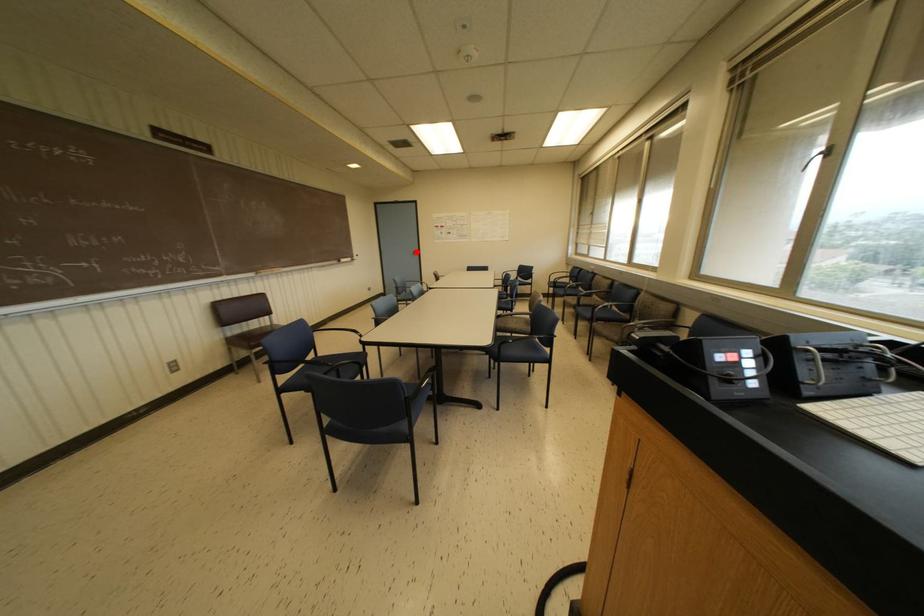
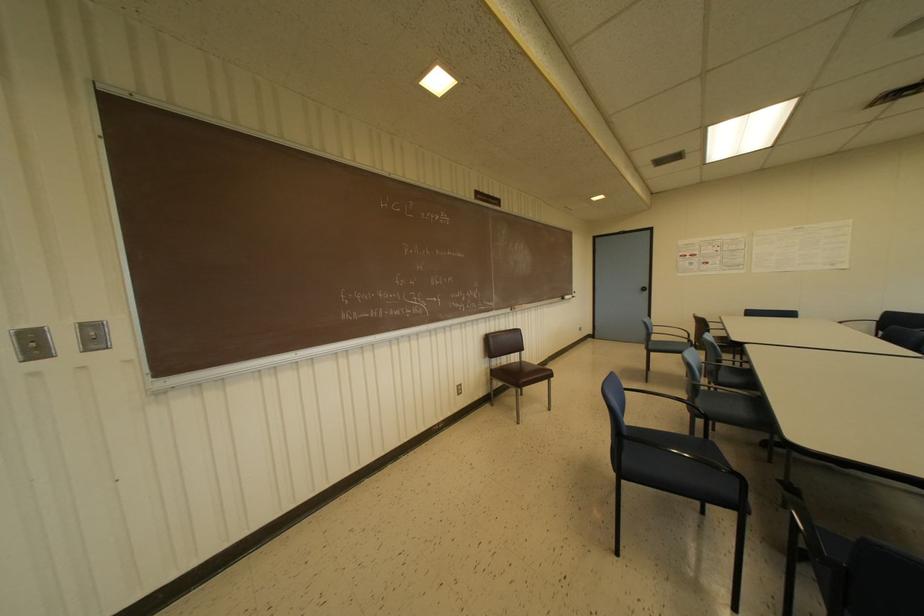
In the second image, find the point that corresponds to the highlighted location in the first image.

(646, 288)